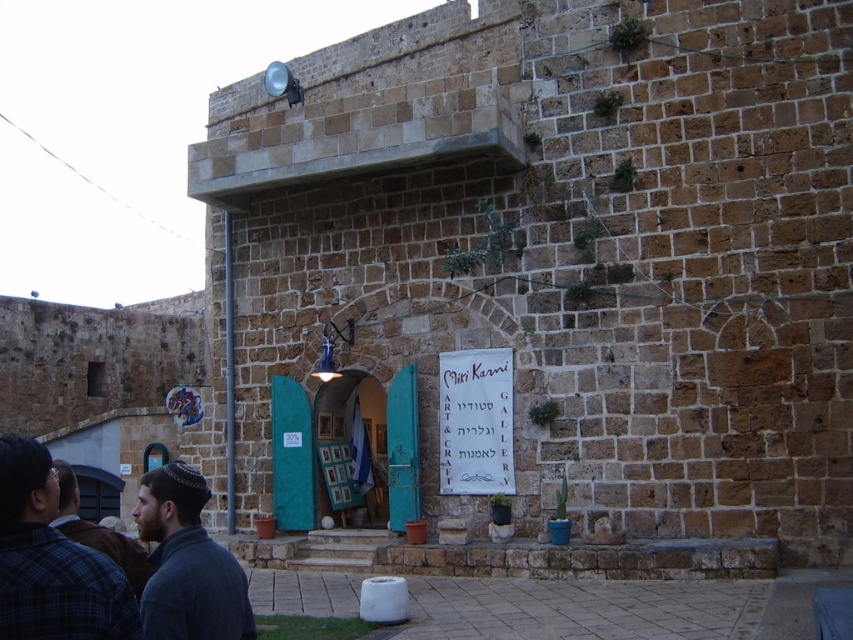
Does dark gray knit sweater at lower left have a lesser height compared to white paper banner at center?

Incorrect, dark gray knit sweater at lower left's height does not fall short of white paper banner at center's.

Where is `dark gray knit sweater at lower left`? Image resolution: width=853 pixels, height=640 pixels. dark gray knit sweater at lower left is located at coordinates click(x=187, y=563).

Who is positioned more to the left, gray wool sweater at lower left or wooden framed pictures at center?

gray wool sweater at lower left is more to the left.

Based on the photo, who is positioned more to the right, gray wool sweater at lower left or wooden framed pictures at center?

wooden framed pictures at center

Where is `gray wool sweater at lower left`? gray wool sweater at lower left is located at coordinates 97,531.

Is the position of plaid fabric shirt at lower left more distant than that of gray wool sweater at lower left?

No, plaid fabric shirt at lower left is closer to the viewer.

Identify the location of plaid fabric shirt at lower left. (51, 561).